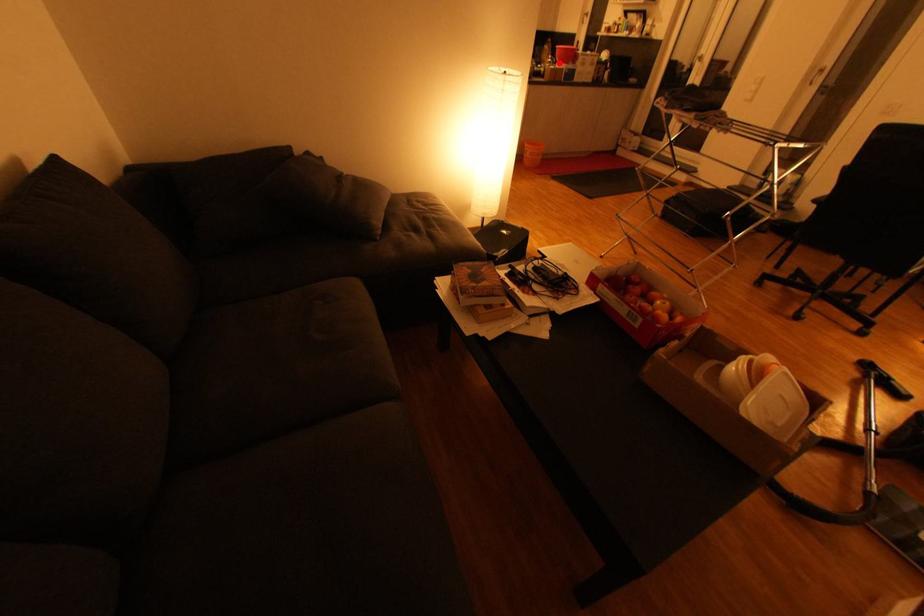
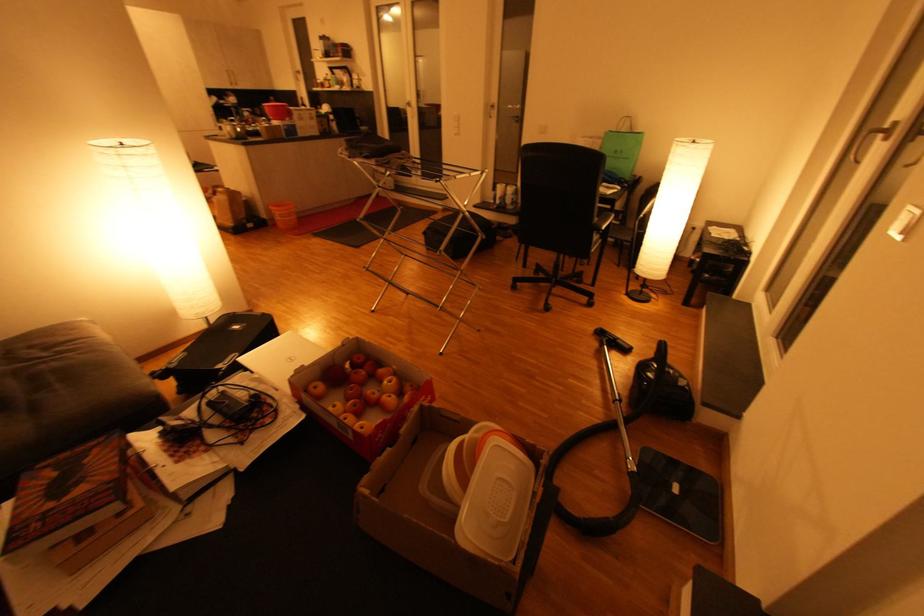
Where in the second image is the point corresponding to the highlighted location from the first image?

(274, 121)